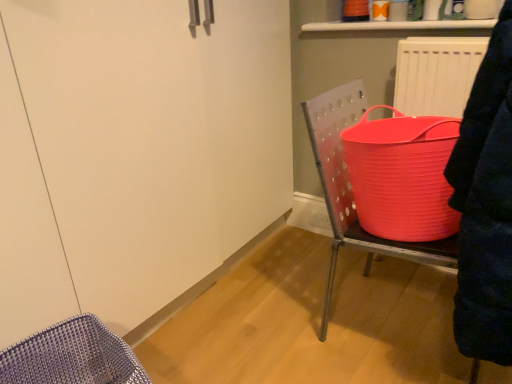
Question: From their relative heights in the image, would you say matte white radiator at upper right is taller or shorter than rubberized plastic bucket at right?

Choices:
 (A) tall
 (B) short

Answer: (B)

Question: Based on their sizes in the image, would you say matte white radiator at upper right is bigger or smaller than rubberized plastic bucket at right?

Choices:
 (A) small
 (B) big

Answer: (A)

Question: Considering the positions of point (424, 89) and point (391, 253), is point (424, 89) closer or farther from the camera than point (391, 253)?

Choices:
 (A) farther
 (B) closer

Answer: (A)

Question: Is point (366, 249) closer or farther from the camera than point (434, 66)?

Choices:
 (A) farther
 (B) closer

Answer: (A)

Question: Looking at the image, does rubberized plastic bucket at right seem bigger or smaller compared to matte white radiator at upper right?

Choices:
 (A) small
 (B) big

Answer: (B)

Question: From a real-world perspective, is rubberized plastic bucket at right positioned above or below matte white radiator at upper right?

Choices:
 (A) above
 (B) below

Answer: (B)

Question: Is rubberized plastic bucket at right wider or thinner than matte white radiator at upper right?

Choices:
 (A) thin
 (B) wide

Answer: (B)